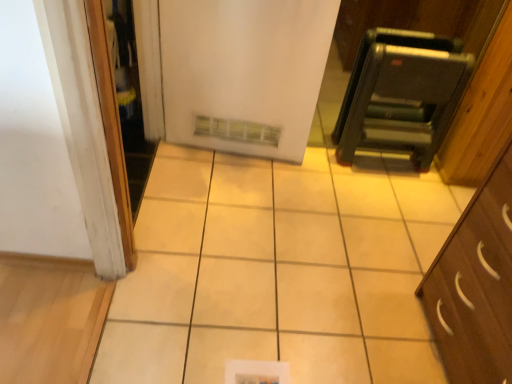
This screenshot has width=512, height=384. Identify the location of space that is in front of white glossy screen door at left. (124, 281).